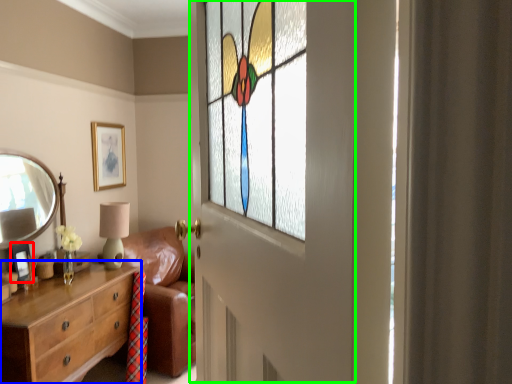
Question: Based on their relative distances, which object is farther from picture frame (highlighted by a red box)? Choose from chest of drawers (highlighted by a blue box) and screen door (highlighted by a green box).

Choices:
 (A) chest of drawers
 (B) screen door

Answer: (B)